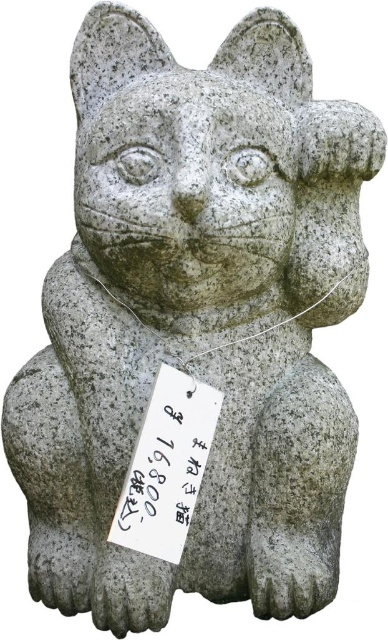
Question: Among these objects, which one is nearest to the camera?

Choices:
 (A) black paper at center
 (B) gray stone cat at center

Answer: (A)

Question: Considering the relative positions of black paper at center and gray stone cat at center in the image provided, where is black paper at center located with respect to gray stone cat at center?

Choices:
 (A) right
 (B) left

Answer: (B)

Question: Is black paper at center to the left of gray stone cat at center from the viewer's perspective?

Choices:
 (A) yes
 (B) no

Answer: (A)

Question: Which point appears closest to the camera in this image?

Choices:
 (A) [x=145, y=540]
 (B) [x=280, y=324]

Answer: (A)

Question: Can you confirm if black paper at center is positioned to the right of gray stone cat at center?

Choices:
 (A) no
 (B) yes

Answer: (A)